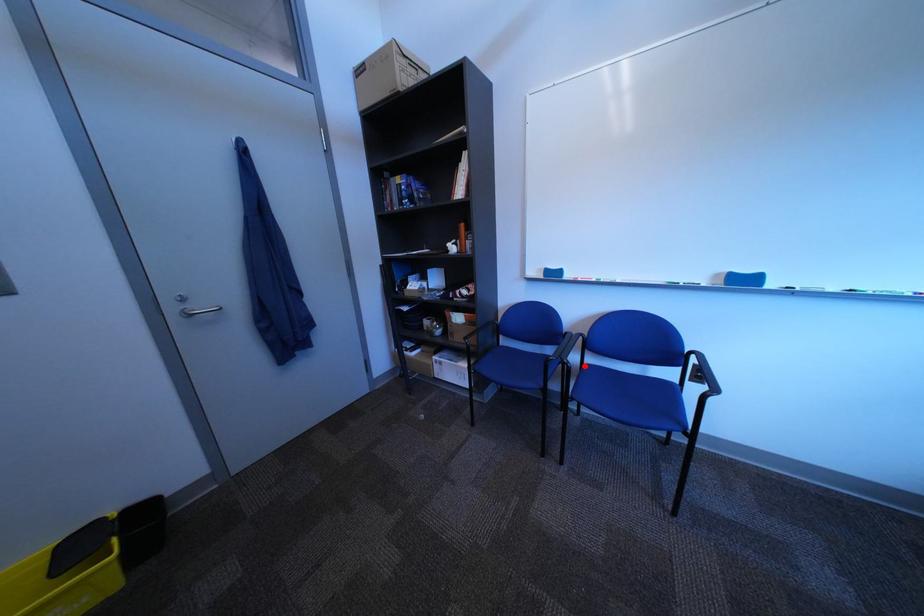
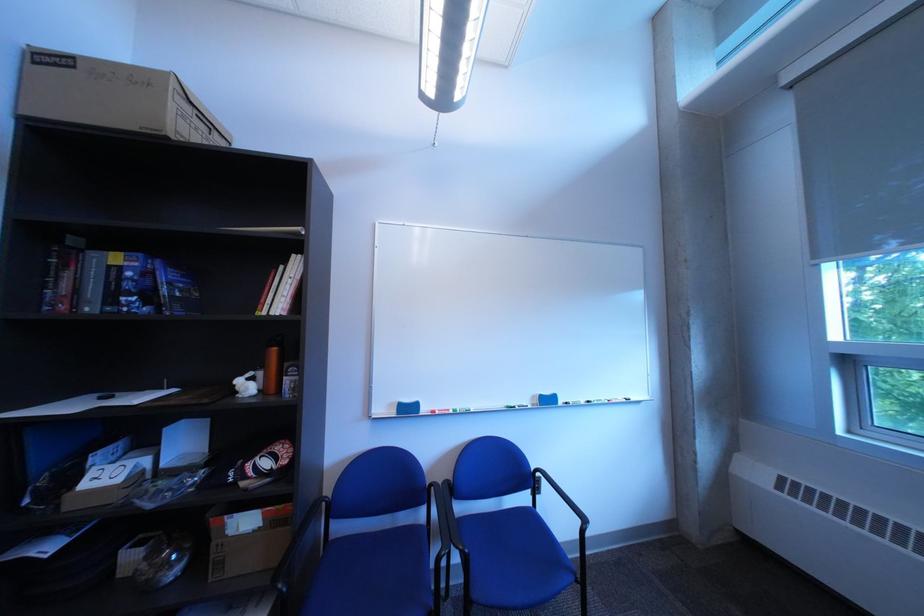
Locate, in the second image, the point that corresponds to the highlighted location in the first image.

(482, 553)